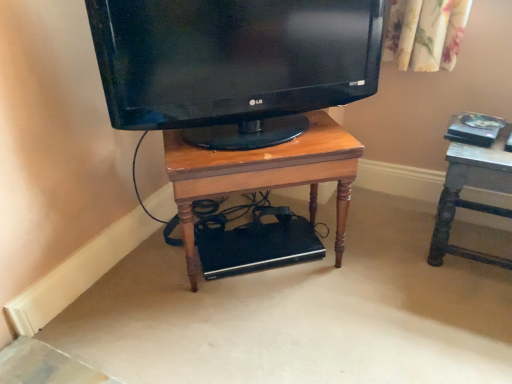
Where is `free location to the right of wooden desk at center`? The width and height of the screenshot is (512, 384). free location to the right of wooden desk at center is located at coordinates (384, 254).